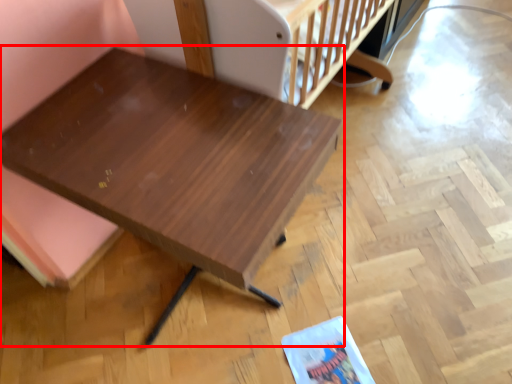
Question: From the image's perspective, what is the correct spatial relationship of table (annotated by the red box) in relation to infant bed?

Choices:
 (A) below
 (B) above

Answer: (A)